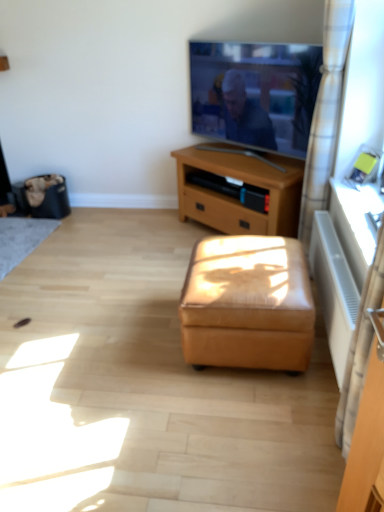
Question: From the image's perspective, is leather ottoman at center under matte black tv at upper center?

Choices:
 (A) yes
 (B) no

Answer: (A)

Question: Is leather ottoman at center shorter than matte black tv at upper center?

Choices:
 (A) yes
 (B) no

Answer: (A)

Question: Is leather ottoman at center at the left side of matte black tv at upper center?

Choices:
 (A) no
 (B) yes

Answer: (B)

Question: From a real-world perspective, is leather ottoman at center below matte black tv at upper center?

Choices:
 (A) no
 (B) yes

Answer: (B)

Question: Is leather ottoman at center touching matte black tv at upper center?

Choices:
 (A) yes
 (B) no

Answer: (B)

Question: Does leather ottoman at center have a greater width compared to matte black tv at upper center?

Choices:
 (A) yes
 (B) no

Answer: (A)

Question: Can you confirm if white checkered curtain at right is taller than matte black tv at upper center?

Choices:
 (A) yes
 (B) no

Answer: (A)

Question: Is matte black tv at upper center a part of white checkered curtain at right?

Choices:
 (A) yes
 (B) no

Answer: (B)

Question: Considering the relative sizes of white checkered curtain at right and matte black tv at upper center in the image provided, is white checkered curtain at right shorter than matte black tv at upper center?

Choices:
 (A) yes
 (B) no

Answer: (B)

Question: Is white checkered curtain at right positioned behind matte black tv at upper center?

Choices:
 (A) no
 (B) yes

Answer: (A)

Question: Are white checkered curtain at right and matte black tv at upper center located far from each other?

Choices:
 (A) no
 (B) yes

Answer: (A)

Question: Is white checkered curtain at right oriented towards matte black tv at upper center?

Choices:
 (A) no
 (B) yes

Answer: (A)

Question: Is matte black tv at upper center completely or partially outside of black fabric trash bin at left?

Choices:
 (A) yes
 (B) no

Answer: (A)